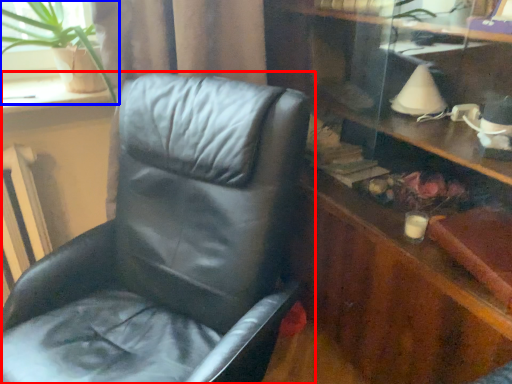
Question: Among these objects, which one is nearest to the camera, chair (highlighted by a red box) or houseplant (highlighted by a blue box)?

Choices:
 (A) chair
 (B) houseplant

Answer: (A)